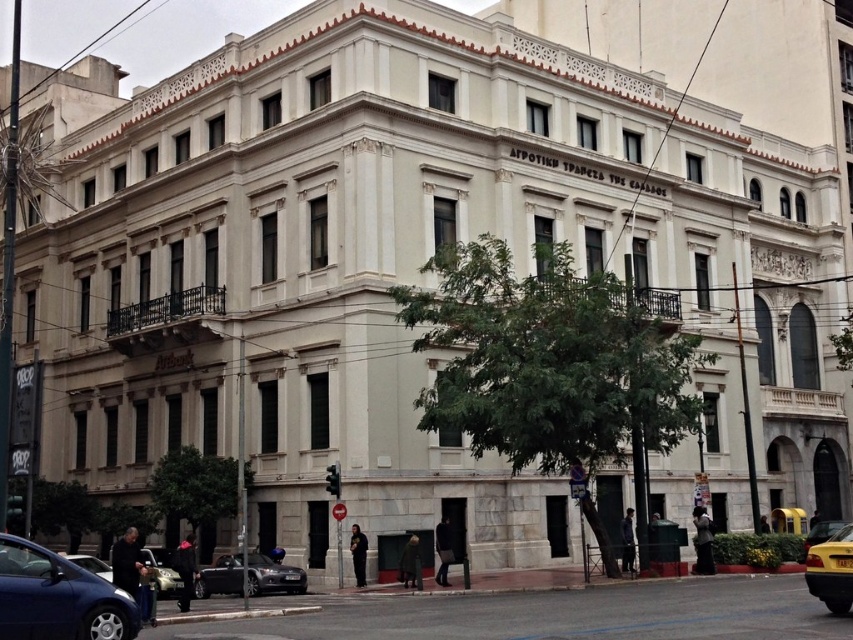
Consider the image. You are standing on the sidewalk in front of the building and want to take a photo of the entire building facade without any obstructions. Considering the shiny black car at lower left and the yellow matte taxi at center, which vehicle should you move to get a clear view?

You should move the shiny black car at lower left because it is positioned above the yellow matte taxi at center, meaning it is closer to the building and blocking more of the lower facade. Removing it would provide a clearer view of the entire structure.

You are standing on the sidewalk in front of the building and want to take a photo of the entire building without any obstructions. The yellow rubber taxi at lower right is blocking your view. Can you move the taxi to a different location so that the building is fully visible?

The yellow rubber taxi at lower right is located at point (x=831, y=570). Moving it to a position outside the frame or behind the tree would allow the building to be fully visible without obstruction.

You are a delivery person trying to park your van between the shiny black car at lower left and the yellow rubber taxi at lower right. Based on the scene, can your van, which is 2 meters tall, fit vertically between them without hitting anything?

The shiny black car at lower left has a lesser height compared to yellow rubber taxi at lower right. Since the tallest object between them is the yellow rubber taxi at lower right, and the height difference isn not specified, but the van is 2 meters tall, it might fit if the space between them is sufficient. However, without exact clearance details, it is uncertain.